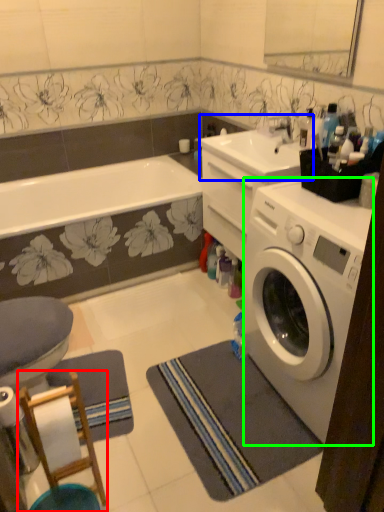
Question: Which object is positioned closest to bar stool (highlighted by a red box)? Select from sink (highlighted by a blue box) and washing machine (highlighted by a green box).

Choices:
 (A) sink
 (B) washing machine

Answer: (B)